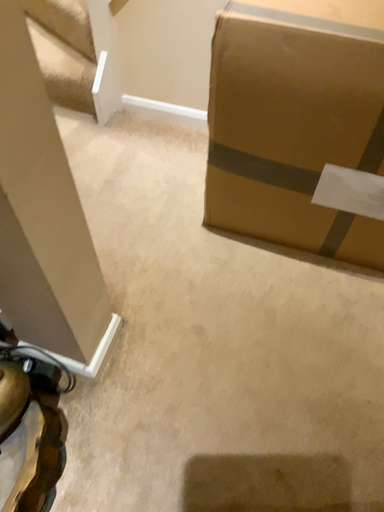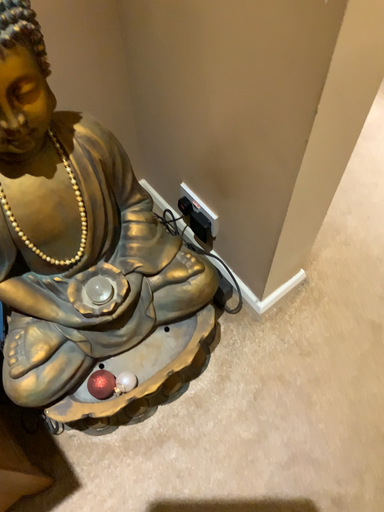
Question: How did the camera likely rotate when shooting the video?

Choices:
 (A) rotated right
 (B) rotated left

Answer: (B)